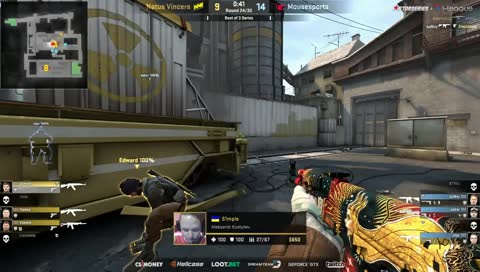
Locate an element on the screen. This screenshot has height=272, width=480. door is located at coordinates (381, 113).